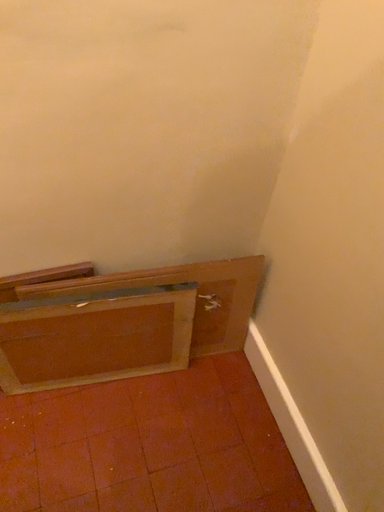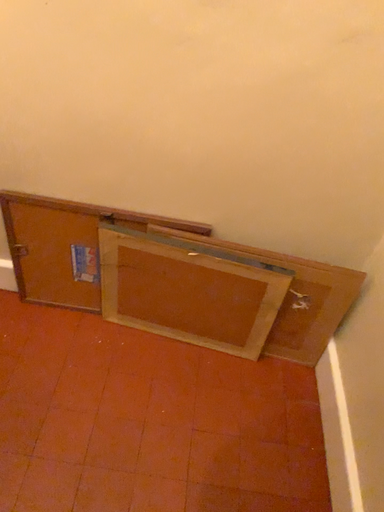
Question: Which way did the camera rotate in the video?

Choices:
 (A) rotated right
 (B) rotated left

Answer: (B)